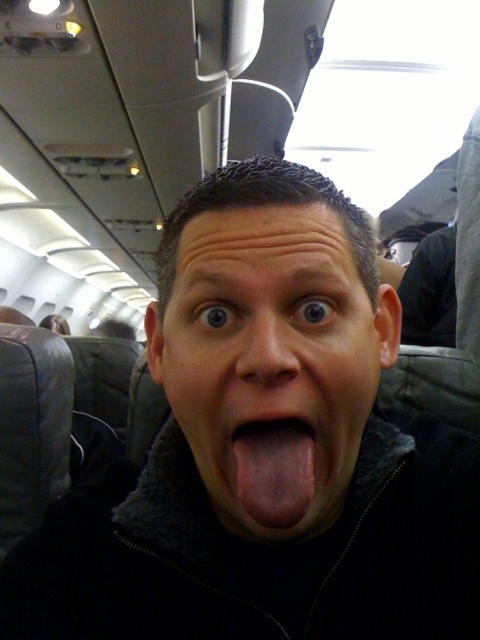
Can you confirm if matte black face at center is bigger than pink flesh-colored tongue at center?

Yes, matte black face at center is bigger than pink flesh-colored tongue at center.

Is point (230, 509) closer to camera compared to point (307, 433)?

No, (230, 509) is behind (307, 433).

In order to click on matte black face at center in this screenshot , I will do pos(269,364).

Is pink flesh-colored tongue at center closer to camera compared to smooth flesh nose at center?

That is False.

Does pink flesh-colored tongue at center appear on the right side of smooth flesh nose at center?

Indeed, pink flesh-colored tongue at center is positioned on the right side of smooth flesh nose at center.

Identify the location of pink flesh-colored tongue at center. This screenshot has width=480, height=640. [x=271, y=472].

Is point (315, 280) closer to viewer compared to point (266, 376)?

That is False.

Is matte black face at center below smooth flesh nose at center?

Yes, matte black face at center is below smooth flesh nose at center.

Is point (284, 372) closer to camera compared to point (238, 369)?

Yes, point (284, 372) is in front of point (238, 369).

At what (x,y) coordinates should I click in order to perform the action: click on matte black face at center. Please return your answer as a coordinate pair (x, y). The width and height of the screenshot is (480, 640). Looking at the image, I should click on (269, 364).